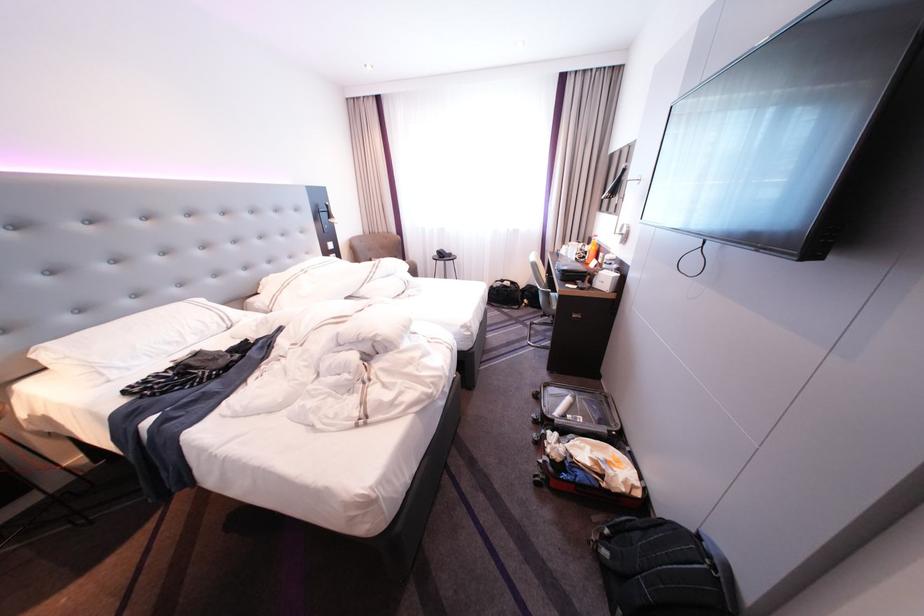
Identify the location of white chair sitting surface. (552, 302).